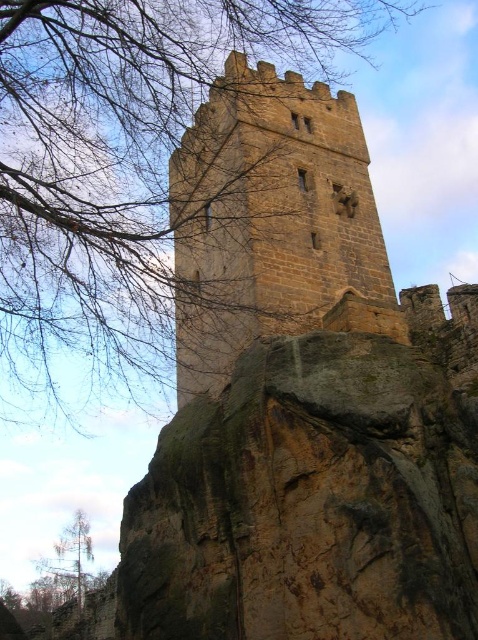
Can you confirm if bare branches at upper left is positioned below brown stone tower at center?

No, bare branches at upper left is not below brown stone tower at center.

Is bare branches at upper left shorter than brown stone tower at center?

Incorrect, bare branches at upper left's height does not fall short of brown stone tower at center's.

I want to click on bare branches at upper left, so click(x=120, y=163).